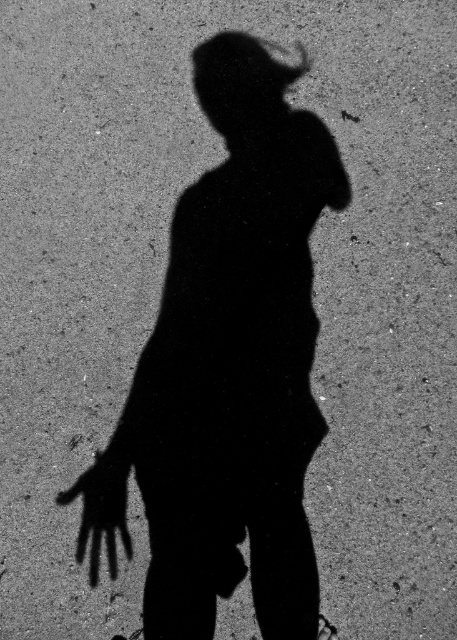
Question: Observing the image, what is the correct spatial positioning of black shadow girl at center in reference to black matte hand at center?

Choices:
 (A) left
 (B) right

Answer: (B)

Question: From the image, what is the correct spatial relationship of black shadow girl at center in relation to black matte hand at center?

Choices:
 (A) above
 (B) below

Answer: (A)

Question: Among these objects, which one is nearest to the camera?

Choices:
 (A) black shadow girl at center
 (B) black matte hand at center

Answer: (A)

Question: Among these objects, which one is nearest to the camera?

Choices:
 (A) black matte hand at center
 (B) black shadow girl at center

Answer: (B)

Question: Among these objects, which one is nearest to the camera?

Choices:
 (A) black matte hand at center
 (B) black shadow girl at center

Answer: (B)

Question: Where is black shadow girl at center located in relation to black matte hand at center in the image?

Choices:
 (A) above
 (B) below

Answer: (A)